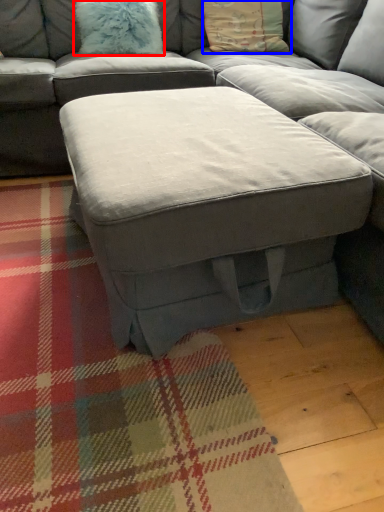
Question: Which point is further to the camera, pillow (highlighted by a red box) or pillow (highlighted by a blue box)?

Choices:
 (A) pillow
 (B) pillow

Answer: (B)